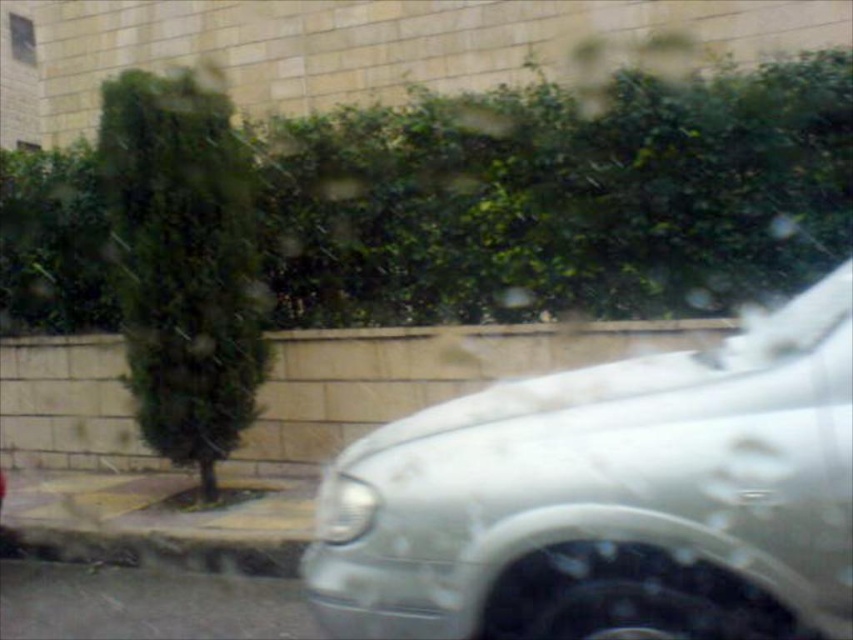
You are inside a car and looking through the rain streaked window. You notice a point marked at coordinates (610,499). What object is located at that point?

The white glossy car at right is located at point (610,499).

You are a delivery driver trying to navigate through the rain. You see the white glossy car at right and the gray concrete curb at lower left through the window. Which object is nearer to your current position?

The white glossy car at right is closer to the viewer than the gray concrete curb at lower left, so the white glossy car at right is nearer to your current position.

You are driving a car and need to park in a tight space. You see the white glossy car at right and the gray concrete curb at lower left in your rearview mirror. Which object is positioned higher in your view?

The white glossy car at right is located above the gray concrete curb at lower left in the view.